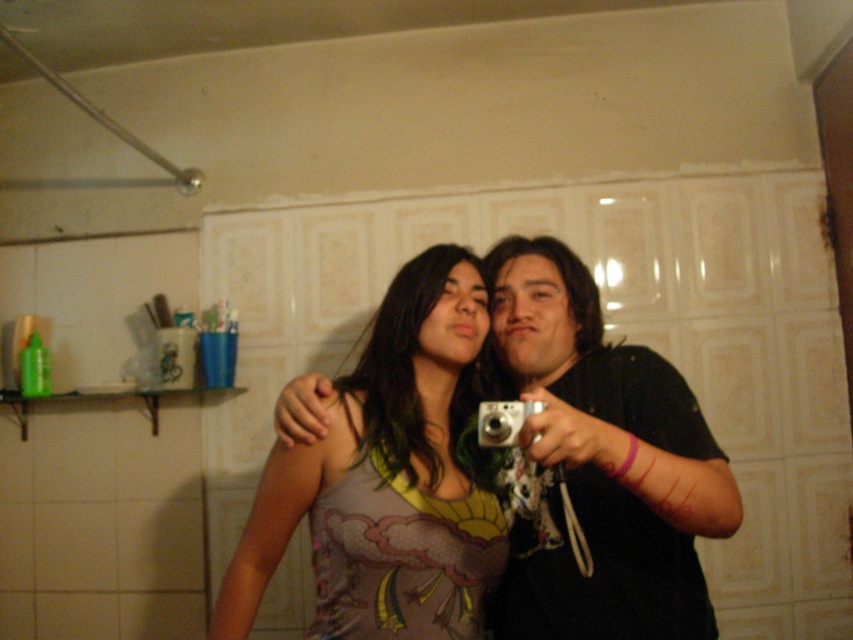
Question: Considering the real-world distances, which object is closest to the black matte camera at center?

Choices:
 (A) silver metallic camera at center
 (B) matte fabric tank top at center

Answer: (B)

Question: Which is nearer to the black matte camera at center?

Choices:
 (A) matte fabric tank top at center
 (B) silver metallic camera at center

Answer: (A)

Question: Which point is farther to the camera?

Choices:
 (A) silver metallic camera at center
 (B) matte fabric tank top at center

Answer: (B)

Question: Can you confirm if black matte camera at center is positioned to the right of silver metallic camera at center?

Choices:
 (A) yes
 (B) no

Answer: (A)

Question: Does black matte camera at center have a larger size compared to silver metallic camera at center?

Choices:
 (A) yes
 (B) no

Answer: (A)

Question: Is matte fabric tank top at center further to the viewer compared to black matte camera at center?

Choices:
 (A) yes
 (B) no

Answer: (A)